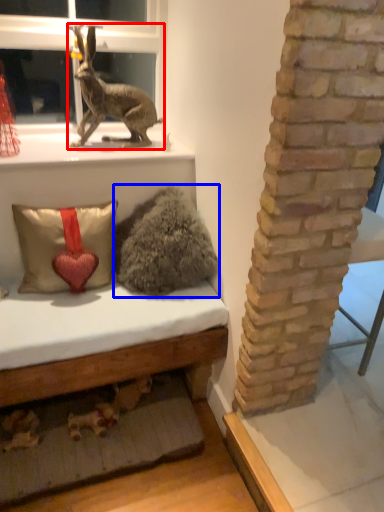
Question: Which object appears farthest to the camera in this image, rabbit (highlighted by a red box) or animal (highlighted by a blue box)?

Choices:
 (A) rabbit
 (B) animal

Answer: (A)